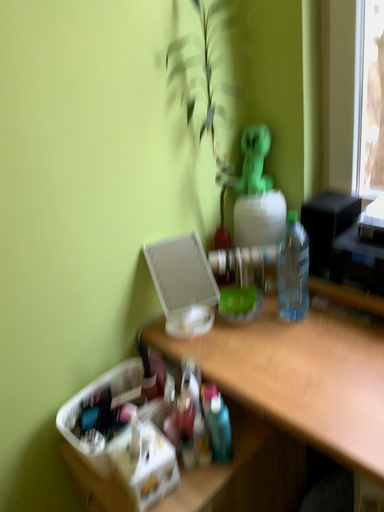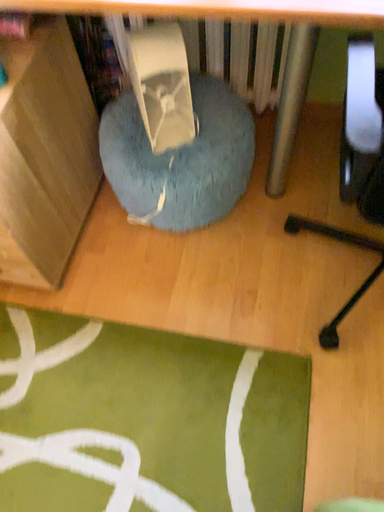
Question: How did the camera likely rotate when shooting the video?

Choices:
 (A) rotated downward
 (B) rotated upward

Answer: (A)